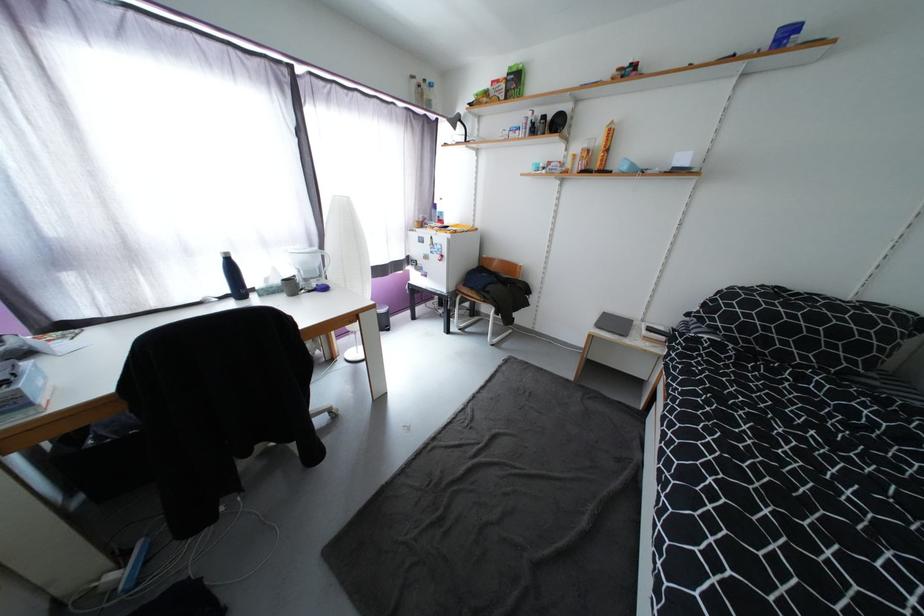
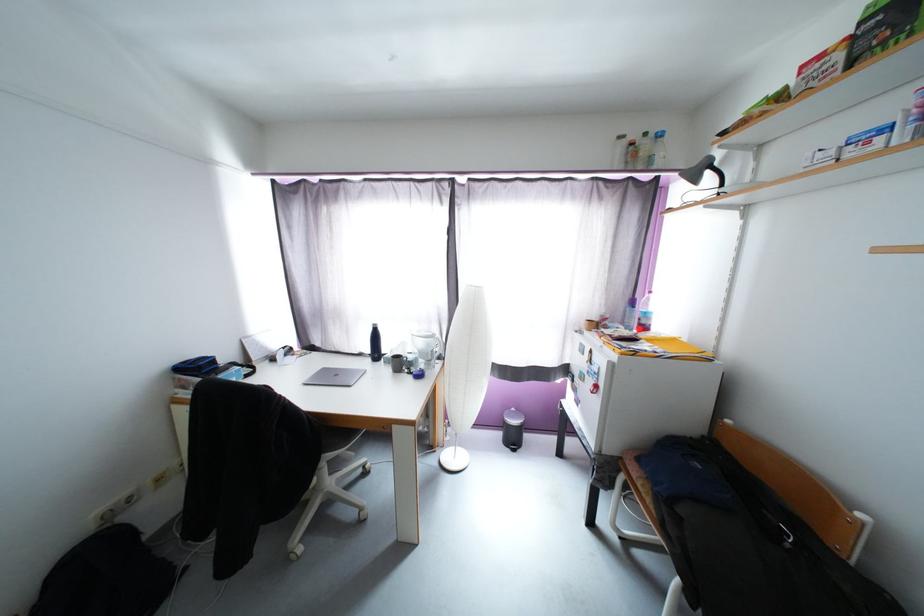
Find the pixel in the second image that matches point 447,215 in the first image.

(651, 315)